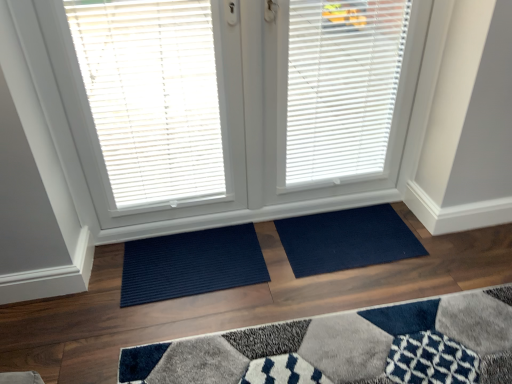
Question: Is white plastic blinds at upper left, which appears as the first window blind when viewed from the left, facing towards navy blue textured mat at lower center, marked as the 2th doormat in a right-to-left arrangement?

Choices:
 (A) no
 (B) yes

Answer: (B)

Question: Considering the relative sizes of white plastic blinds at upper left, which appears as the first window blind when viewed from the left, and navy blue textured mat at lower center, marked as the 2th doormat in a right-to-left arrangement, in the image provided, is white plastic blinds at upper left, which appears as the first window blind when viewed from the left, taller than navy blue textured mat at lower center, marked as the 2th doormat in a right-to-left arrangement,?

Choices:
 (A) yes
 (B) no

Answer: (A)

Question: From the image's perspective, is white plastic blinds at upper left, which ranks as the second window blind in right-to-left order, located beneath navy blue textured mat at lower center, marked as the 2th doormat in a right-to-left arrangement?

Choices:
 (A) no
 (B) yes

Answer: (A)

Question: Can you confirm if white plastic blinds at upper left, which appears as the first window blind when viewed from the left, is positioned to the left of navy blue textured mat at lower center, which is counted as the first doormat, starting from the left?

Choices:
 (A) no
 (B) yes

Answer: (B)

Question: Does white plastic blinds at upper left, which appears as the first window blind when viewed from the left, lie behind navy blue textured mat at lower center, marked as the 2th doormat in a right-to-left arrangement?

Choices:
 (A) no
 (B) yes

Answer: (A)

Question: From a real-world perspective, is navy blue textured mat at lower center, which is counted as the first doormat, starting from the left, physically located above or below white matte window blind at center, the 1th window blind from the right?

Choices:
 (A) below
 (B) above

Answer: (A)

Question: Looking at the image, does navy blue textured mat at lower center, which is counted as the first doormat, starting from the left, seem bigger or smaller compared to white matte window blind at center, the 1th window blind from the right?

Choices:
 (A) small
 (B) big

Answer: (A)

Question: Considering the positions of navy blue textured mat at lower center, marked as the 2th doormat in a right-to-left arrangement, and white matte window blind at center, the 1th window blind from the right, in the image, is navy blue textured mat at lower center, marked as the 2th doormat in a right-to-left arrangement, taller or shorter than white matte window blind at center, the 1th window blind from the right,?

Choices:
 (A) short
 (B) tall

Answer: (A)

Question: Is navy blue textured mat at lower center, which is counted as the first doormat, starting from the left, inside or outside of white matte window blind at center, the 1th window blind from the right?

Choices:
 (A) inside
 (B) outside

Answer: (B)

Question: Considering the relative positions of navy blue mat at center, the 1th doormat when ordered from right to left, and white matte window blind at center, the 1th window blind from the right, in the image provided, is navy blue mat at center, the 1th doormat when ordered from right to left, to the left or to the right of white matte window blind at center, the 1th window blind from the right,?

Choices:
 (A) right
 (B) left

Answer: (A)

Question: Looking at their shapes, would you say navy blue mat at center, the 1th doormat when ordered from right to left, is wider or thinner than white matte window blind at center, which ranks as the second window blind in left-to-right order?

Choices:
 (A) wide
 (B) thin

Answer: (A)

Question: From a real-world perspective, is navy blue mat at center, the 1th doormat when ordered from right to left, positioned above or below white matte window blind at center, which ranks as the second window blind in left-to-right order?

Choices:
 (A) below
 (B) above

Answer: (A)

Question: Is navy blue mat at center, which appears as the second doormat when viewed from the left, taller or shorter than white matte window blind at center, which ranks as the second window blind in left-to-right order?

Choices:
 (A) short
 (B) tall

Answer: (A)

Question: From a real-world perspective, relative to white matte window blind at center, which ranks as the second window blind in left-to-right order, is white matte blinds at center vertically above or below?

Choices:
 (A) below
 (B) above

Answer: (B)

Question: Is white matte blinds at center to the left or to the right of white matte window blind at center, which ranks as the second window blind in left-to-right order, in the image?

Choices:
 (A) right
 (B) left

Answer: (B)